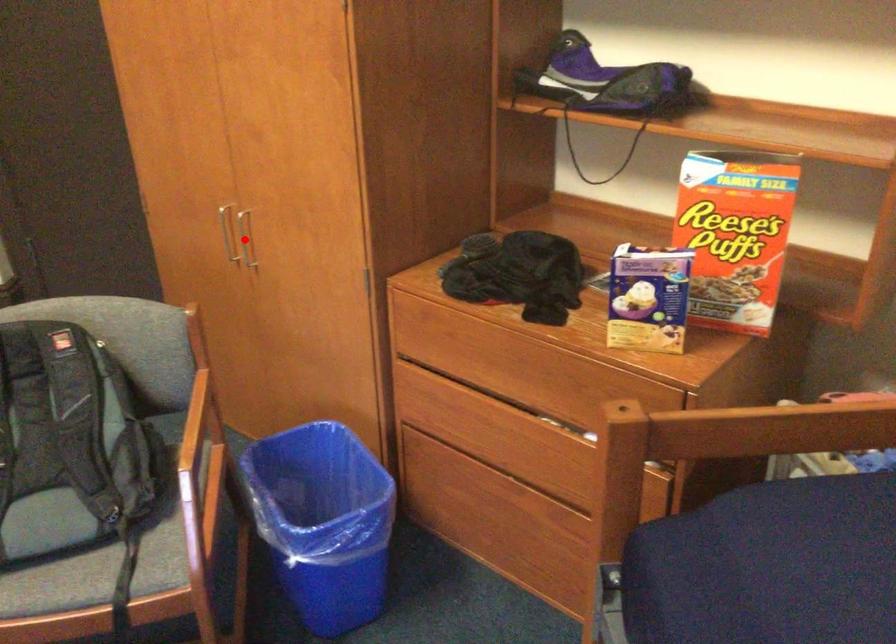
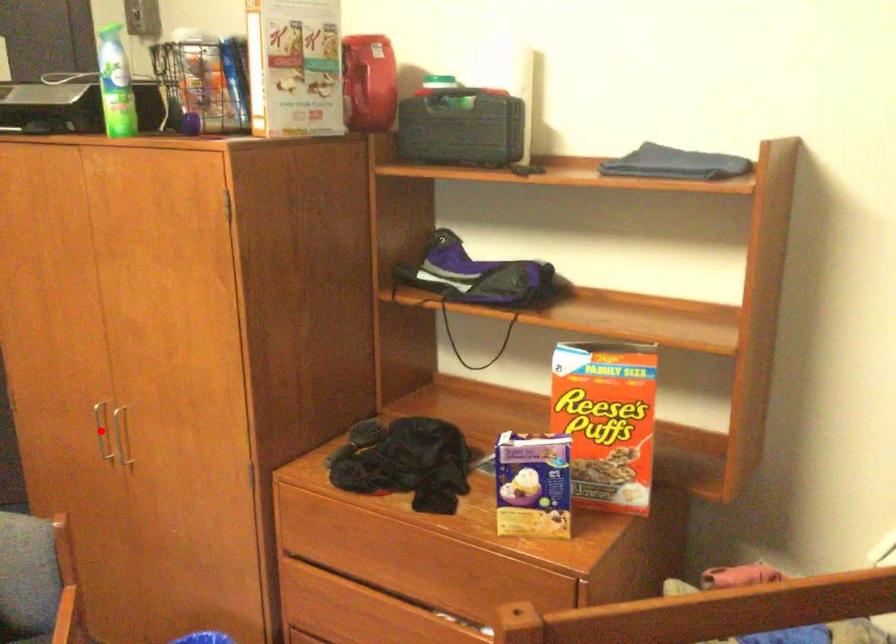
I am providing you with two images of the same scene from different viewpoints. A red point is marked on the first image and another point is marked on the second image. Is the red point in image1 aligned with the point shown in image2?

No